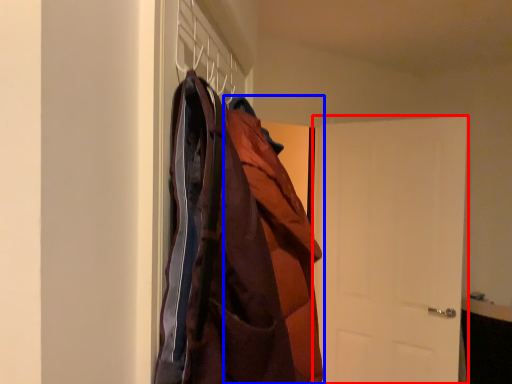
Question: Which object appears farthest to the camera in this image, door (highlighted by a red box) or cloak (highlighted by a blue box)?

Choices:
 (A) door
 (B) cloak

Answer: (A)